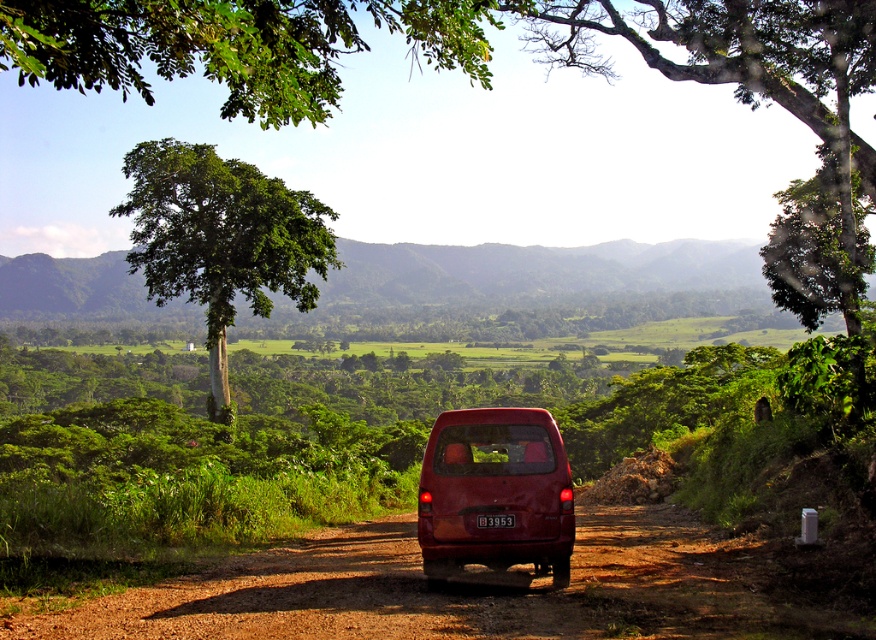
You are a driver who needs to park your car on the dusty brown dirt track at center. However, you have a red plastic license plate at rear center that might block the parking space. Will the license plate interfere with parking?

The dusty brown dirt track at center is bigger than the red plastic license plate at rear center, so the license plate will not interfere with parking on the track.

You are driving a car and want to park behind the matte red van at center. There is a green leafy tree at upper left in your way. Can you park there without hitting the tree?

The green leafy tree at upper left is above the matte red van at center, so it is not blocking the parking space behind the van. You can park there without hitting the tree.

You are a delivery driver who needs to turn around your red minivan parked on the dirt road. The point at coordinates (467, 589) is crucial for determining the turning space. Can you safely make a U turn here?

The point at coordinates (467, 589) corresponds to the dusty brown dirt track at center. Since the road is unpaved and winding, there might not be enough space for a U turn. Check the surroundings for a wider section of the road.